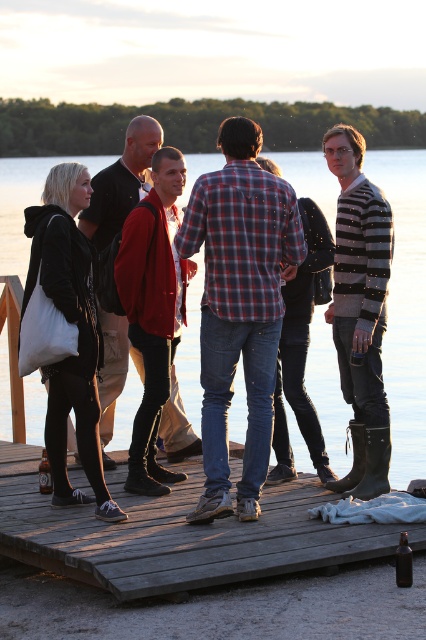
Can you confirm if plaid fabric shirt at center is shorter than red sweater at center?

Incorrect, plaid fabric shirt at center's height does not fall short of red sweater at center's.

Is point (259, 458) less distant than point (138, 124)?

That is True.

Find the location of a particular element. This screenshot has height=640, width=426. plaid fabric shirt at center is located at coordinates (239, 307).

Who is more forward, (247, 451) or (339, 310)?

Point (247, 451) is more forward.

Based on the photo, which is more to the left, plaid fabric shirt at center or striped sweater at right?

From the viewer's perspective, plaid fabric shirt at center appears more on the left side.

Between point (296, 259) and point (342, 173), which one is positioned in front?

Point (296, 259) is more forward.

Locate an element on the screen. plaid fabric shirt at center is located at coordinates (239, 307).

Between transparent water at center and plaid fabric shirt at center, which one is positioned higher?

transparent water at center is above.

The width and height of the screenshot is (426, 640). Identify the location of transparent water at center. (405, 307).